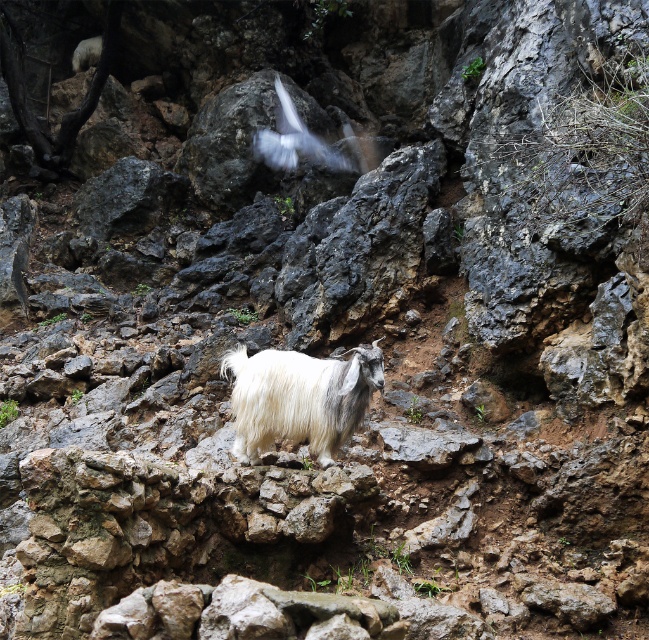
Is white woolen goat at center thinner than white fluffy bird at upper center?

Correct, white woolen goat at center's width is less than white fluffy bird at upper center's.

Who is positioned more to the left, white woolen goat at center or white fluffy bird at upper center?

white fluffy bird at upper center is more to the left.

Which is in front, point (278, 372) or point (328, 148)?

Positioned in front is point (278, 372).

The image size is (649, 640). What are the coordinates of `white woolen goat at center` in the screenshot? It's located at (299, 397).